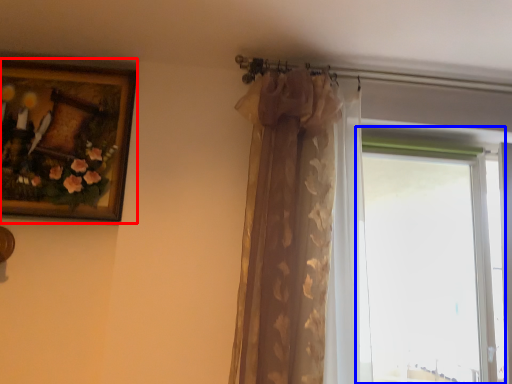
Question: Which point is closer to the camera, picture frame (highlighted by a red box) or window (highlighted by a blue box)?

Choices:
 (A) picture frame
 (B) window

Answer: (A)